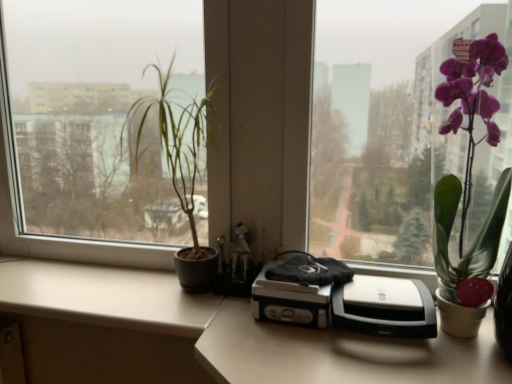
Identify the location of beige matte counter top at lower left. This screenshot has height=384, width=512. (104, 297).

This screenshot has height=384, width=512. In order to click on silver/black plastic printer at center in this screenshot , I will do (384, 308).

The image size is (512, 384). What are the coordinates of `green matte plant at left, positioned as the 1th houseplant in left-to-right order` in the screenshot? It's located at (180, 164).

Which is further, (77, 293) or (353, 281)?

The point (77, 293) is farther from the camera.

From the image's perspective, is beige matte counter top at lower left beneath silver/black plastic printer at center?

Yes, from the image's perspective, beige matte counter top at lower left is beneath silver/black plastic printer at center.

How different are the orientations of beige matte counter top at lower left and silver/black plastic printer at center in degrees?

They differ by 0.000149 degrees in their facing directions.

Which is behind, beige matte counter top at lower left or silver/black plastic printer at center?

Positioned behind is beige matte counter top at lower left.

Is silver/black plastic printer at center with beige matte counter top at lower left?

No, silver/black plastic printer at center is not in contact with beige matte counter top at lower left.

Looking at this image, is the position of silver/black plastic printer at center less distant than that of beige matte counter top at lower left?

Yes, it is in front of beige matte counter top at lower left.

Looking at the image, does silver/black plastic printer at center seem bigger or smaller compared to beige matte counter top at lower left?

Clearly, silver/black plastic printer at center is smaller in size than beige matte counter top at lower left.

From a real-world perspective, is silver/black plastic printer at center over beige matte counter top at lower left?

Yes, from a real-world perspective, silver/black plastic printer at center is over beige matte counter top at lower left

Is point (377, 314) less distant than point (447, 301)?

Yes, it is in front of point (447, 301).

How many degrees apart are the facing directions of silver/black plastic printer at center and purple glossy orchid at right, which is counted as the 1th houseplant, starting from the right?

0.474 degrees.

In order to click on printer below the purple glossy orchid at right, which is counted as the 1th houseplant, starting from the right (from a real-world perspective) in this screenshot , I will do `click(384, 308)`.

Considering the sizes of silver/black plastic printer at center and purple glossy orchid at right, the 2th houseplant viewed from the left, in the image, is silver/black plastic printer at center taller or shorter than purple glossy orchid at right, the 2th houseplant viewed from the left,?

Clearly, silver/black plastic printer at center is shorter compared to purple glossy orchid at right, the 2th houseplant viewed from the left.

Which of these two, purple glossy orchid at right, the 2th houseplant viewed from the left, or beige matte counter top at lower left, is wider?

Wider between the two is beige matte counter top at lower left.

Could you tell me if purple glossy orchid at right, the 2th houseplant viewed from the left, is turned towards beige matte counter top at lower left?

No, purple glossy orchid at right, the 2th houseplant viewed from the left, is not oriented towards beige matte counter top at lower left.

Where is `counter top that is below the purple glossy orchid at right, which is counted as the 1th houseplant, starting from the right (from the image's perspective)`? counter top that is below the purple glossy orchid at right, which is counted as the 1th houseplant, starting from the right (from the image's perspective) is located at coordinates (104, 297).

Considering the sizes of purple glossy orchid at right, the 2th houseplant viewed from the left, and beige matte counter top at lower left in the image, is purple glossy orchid at right, the 2th houseplant viewed from the left, bigger or smaller than beige matte counter top at lower left?

In the image, purple glossy orchid at right, the 2th houseplant viewed from the left, appears to be larger than beige matte counter top at lower left.

The width and height of the screenshot is (512, 384). Identify the location of counter top below the purple glossy orchid at right, the 2th houseplant viewed from the left (from a real-world perspective). (104, 297).

Is beige matte counter top at lower left to the left of purple glossy orchid at right, which is counted as the 1th houseplant, starting from the right, from the viewer's perspective?

Indeed, beige matte counter top at lower left is positioned on the left side of purple glossy orchid at right, which is counted as the 1th houseplant, starting from the right.

Is beige matte counter top at lower left bigger than purple glossy orchid at right, the 2th houseplant viewed from the left?

Actually, beige matte counter top at lower left might be smaller than purple glossy orchid at right, the 2th houseplant viewed from the left.

From a real-world perspective, is beige matte counter top at lower left located beneath purple glossy orchid at right, the 2th houseplant viewed from the left?

Correct, in the physical world, beige matte counter top at lower left is lower than purple glossy orchid at right, the 2th houseplant viewed from the left.

Considering the relative positions of green matte plant at left, which is the second houseplant from right to left, and silver/black plastic printer at center in the image provided, is green matte plant at left, which is the second houseplant from right to left, to the left or to the right of silver/black plastic printer at center?

Based on their positions, green matte plant at left, which is the second houseplant from right to left, is located to the left of silver/black plastic printer at center.

Considering the positions of points (138, 124) and (347, 319), is point (138, 124) farther from camera compared to point (347, 319)?

Yes.

In the scene shown: Who is more distant, green matte plant at left, which is the second houseplant from right to left, or silver/black plastic printer at center?

green matte plant at left, which is the second houseplant from right to left, is behind.

Is green matte plant at left, positioned as the 1th houseplant in left-to-right order, beside silver/black plastic printer at center?

There is a gap between green matte plant at left, positioned as the 1th houseplant in left-to-right order, and silver/black plastic printer at center.

At what (x,y) coordinates should I click in order to perform the action: click on counter top behind the green matte plant at left, positioned as the 1th houseplant in left-to-right order. Please return your answer as a coordinate pair (x, y). Looking at the image, I should click on (104, 297).

Looking at this image, is beige matte counter top at lower left facing away from green matte plant at left, which is the second houseplant from right to left?

No, beige matte counter top at lower left is not facing the opposite direction of green matte plant at left, which is the second houseplant from right to left.

Considering the sizes of objects beige matte counter top at lower left and green matte plant at left, positioned as the 1th houseplant in left-to-right order, in the image provided, who is wider, beige matte counter top at lower left or green matte plant at left, positioned as the 1th houseplant in left-to-right order,?

Wider between the two is beige matte counter top at lower left.

Is green matte plant at left, positioned as the 1th houseplant in left-to-right order, completely or partially inside beige matte counter top at lower left?

No.

Where is `counter top that appears on the left of silver/black plastic printer at center`? counter top that appears on the left of silver/black plastic printer at center is located at coordinates (104, 297).

This screenshot has width=512, height=384. I want to click on printer above the beige matte counter top at lower left (from a real-world perspective), so click(x=384, y=308).

Considering their positions, is beige matte counter top at lower left positioned closer to green matte plant at left, positioned as the 1th houseplant in left-to-right order, than silver/black plastic printer at center?

beige matte counter top at lower left is positioned closer to the anchor green matte plant at left, positioned as the 1th houseplant in left-to-right order.

Based on their spatial positions, is green matte plant at left, positioned as the 1th houseplant in left-to-right order, or silver/black plastic printer at center further from purple glossy orchid at right, the 2th houseplant viewed from the left?

green matte plant at left, positioned as the 1th houseplant in left-to-right order, is further to purple glossy orchid at right, the 2th houseplant viewed from the left.

From the image, which object appears to be nearer to green matte plant at left, which is the second houseplant from right to left, beige matte counter top at lower left or purple glossy orchid at right, which is counted as the 1th houseplant, starting from the right?

Based on the image, beige matte counter top at lower left appears to be nearer to green matte plant at left, which is the second houseplant from right to left.

Looking at the image, which one is located closer to purple glossy orchid at right, which is counted as the 1th houseplant, starting from the right, green matte plant at left, which is the second houseplant from right to left, or beige matte counter top at lower left?

Among the two, beige matte counter top at lower left is located nearer to purple glossy orchid at right, which is counted as the 1th houseplant, starting from the right.

Based on their spatial positions, is purple glossy orchid at right, the 2th houseplant viewed from the left, or beige matte counter top at lower left closer to silver/black plastic printer at center?

Among the two, purple glossy orchid at right, the 2th houseplant viewed from the left, is located nearer to silver/black plastic printer at center.

Considering their positions, is silver/black plastic printer at center positioned closer to beige matte counter top at lower left than purple glossy orchid at right, the 2th houseplant viewed from the left?

silver/black plastic printer at center.

When comparing their distances from green matte plant at left, positioned as the 1th houseplant in left-to-right order, does purple glossy orchid at right, which is counted as the 1th houseplant, starting from the right, or beige matte counter top at lower left seem further?

Based on the image, purple glossy orchid at right, which is counted as the 1th houseplant, starting from the right, appears to be further to green matte plant at left, positioned as the 1th houseplant in left-to-right order.

Which object lies further to the anchor point green matte plant at left, which is the second houseplant from right to left, silver/black plastic printer at center or purple glossy orchid at right, which is counted as the 1th houseplant, starting from the right?

purple glossy orchid at right, which is counted as the 1th houseplant, starting from the right.

Identify the location of printer situated between green matte plant at left, which is the second houseplant from right to left, and purple glossy orchid at right, the 2th houseplant viewed from the left, from left to right. 384,308.

At what (x,y) coordinates should I click in order to perform the action: click on printer located between beige matte counter top at lower left and purple glossy orchid at right, the 2th houseplant viewed from the left, in the left-right direction. Please return your answer as a coordinate pair (x, y). Looking at the image, I should click on (384, 308).

You are a GUI agent. You are given a task and a screenshot of the screen. Output one action in this format:
    pyautogui.click(x=<x>, y=<y>)
    Task: Click on the houseplant located between beige matte counter top at lower left and silver/black plastic printer at center in the left-right direction
    
    Given the screenshot: What is the action you would take?
    pyautogui.click(x=180, y=164)

The width and height of the screenshot is (512, 384). In order to click on houseplant between beige matte counter top at lower left and purple glossy orchid at right, which is counted as the 1th houseplant, starting from the right, from left to right in this screenshot , I will do `click(180, 164)`.